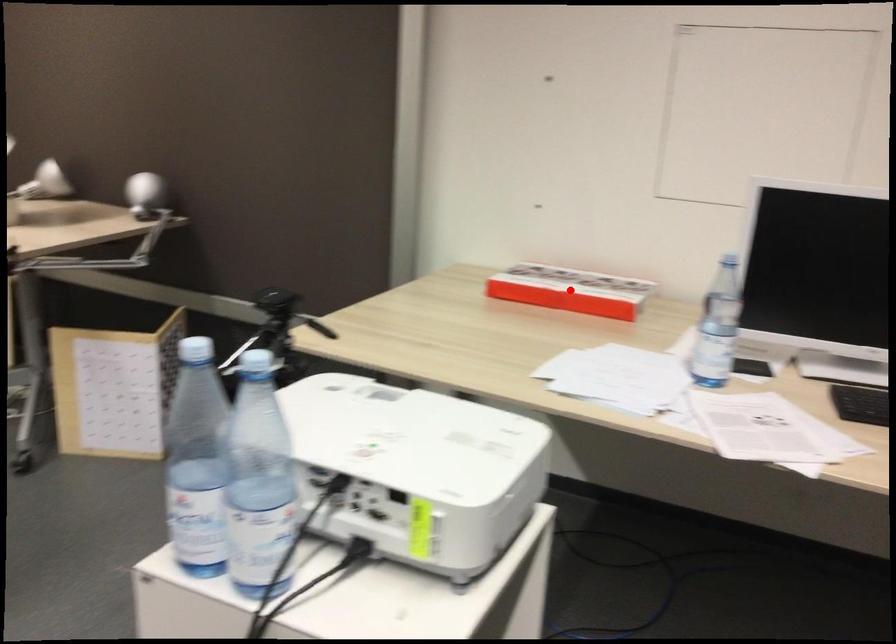
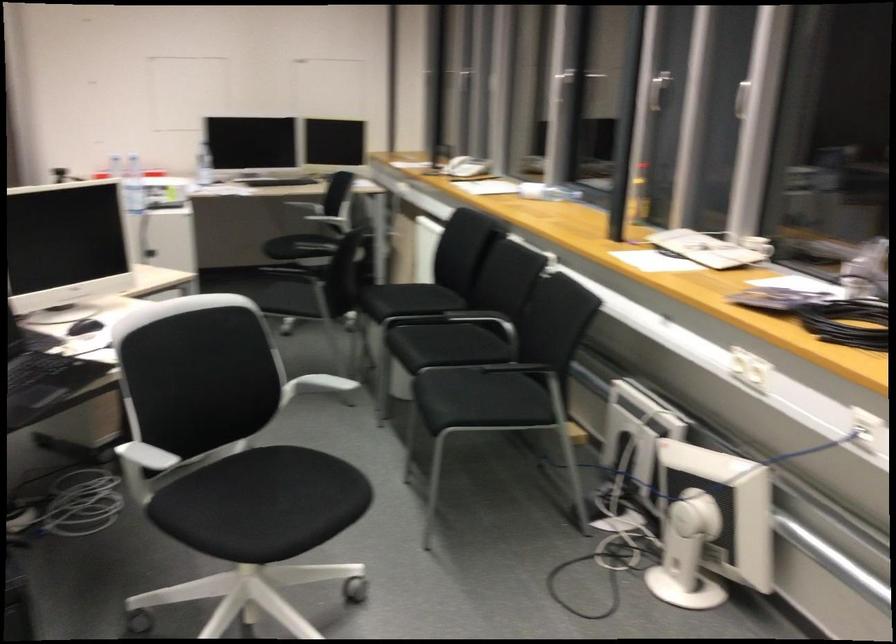
Question: I am providing you with two images of the same scene from different viewpoints. A red point is marked on the first image. Is the red point's position out of view in image 2?

Choices:
 (A) Yes
 (B) No

Answer: (A)